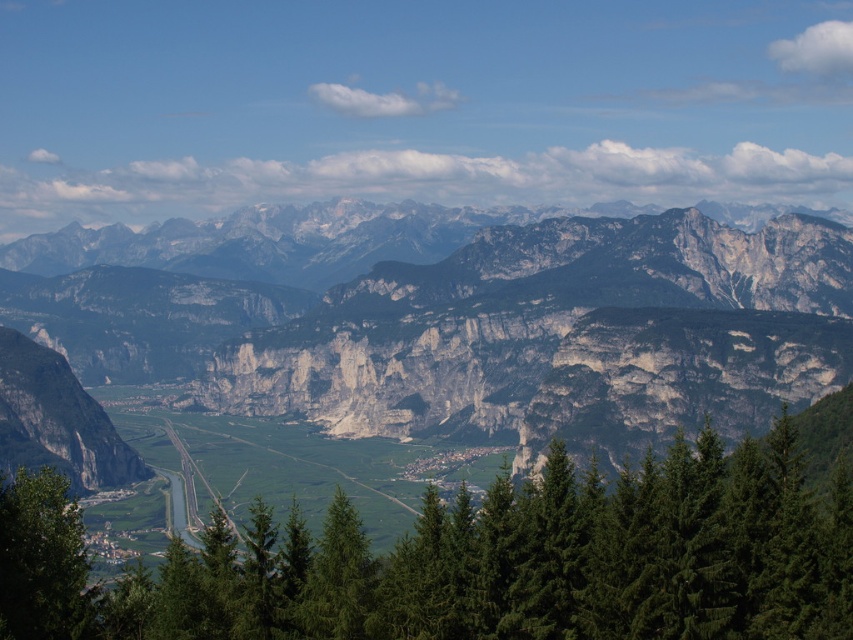
You are standing at the point marked as point (485, 332) in the image. What can you see directly in front of you?

You can see the rocky gray mountain range at center directly in front of you at point (485, 332).

You are a hiker standing at the edge of the valley looking towards the mountains. You see the green leafy tree at lower left and the rocky gray mountain range at center. Which object is closer to you?

The green leafy tree at lower left is behind the rocky gray mountain range at center, so the rocky gray mountain range at center is closer to you.